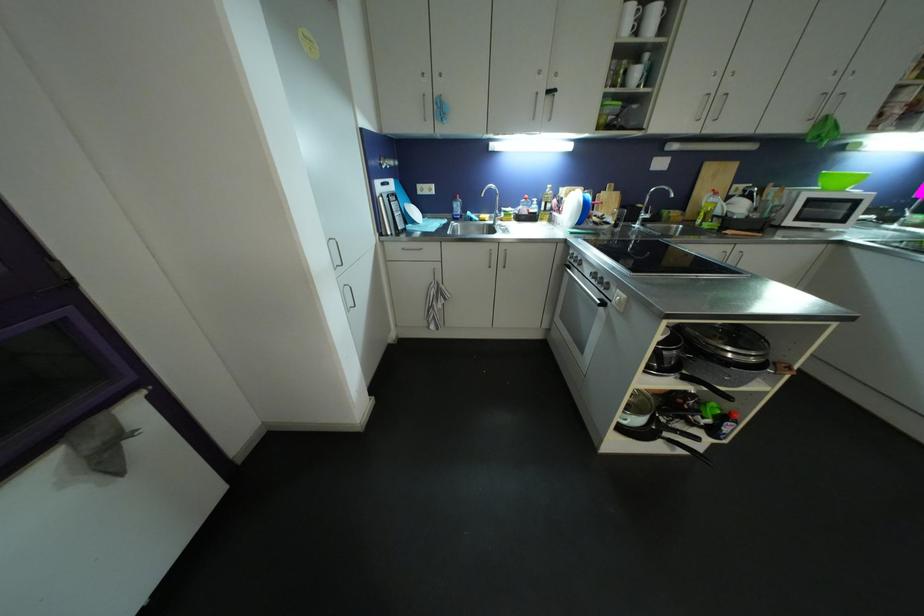
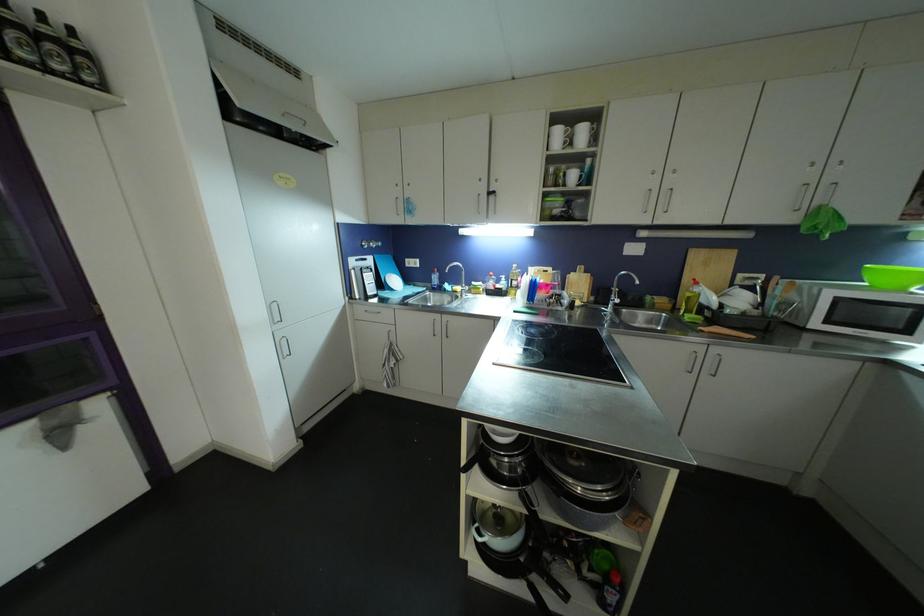
Question: What movement of the cameraman would produce the second image?

Choices:
 (A) Left
 (B) Right
 (C) Forward
 (D) Backward

Answer: (B)